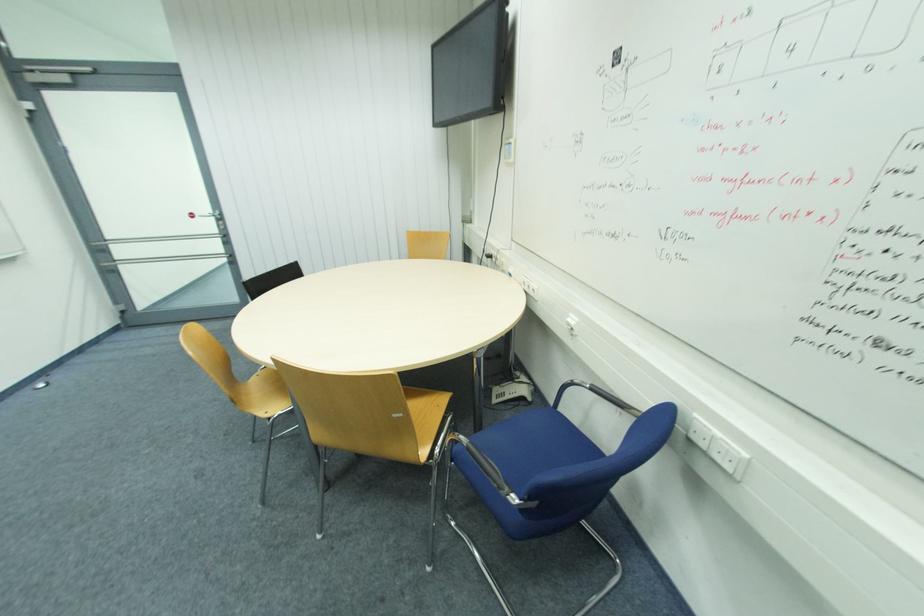
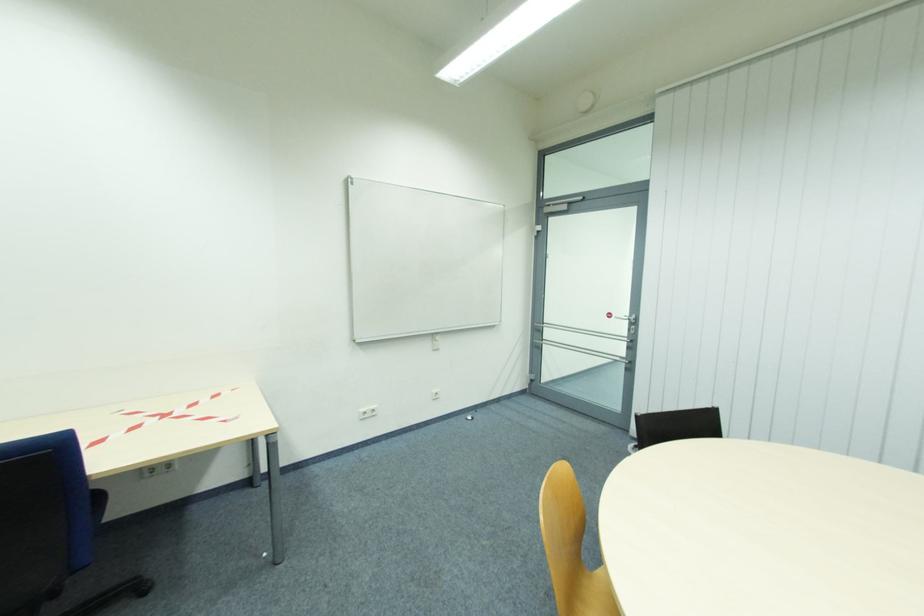
Question: The camera is either moving clockwise (left) or counter-clockwise (right) around the object. The first image is from the beginning of the video and the second image is from the end. Is the camera moving left or right when shooting the video?

Choices:
 (A) Left
 (B) Right

Answer: (B)